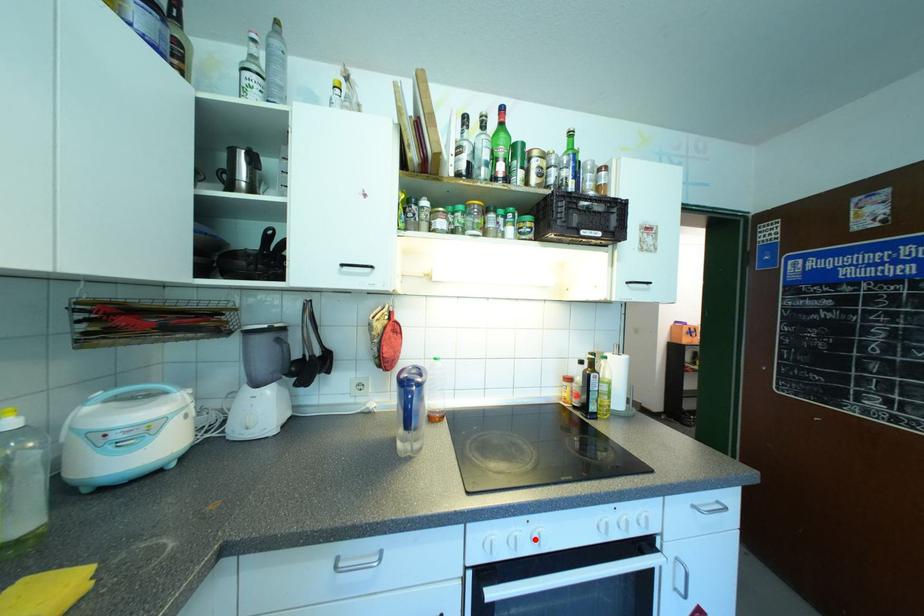
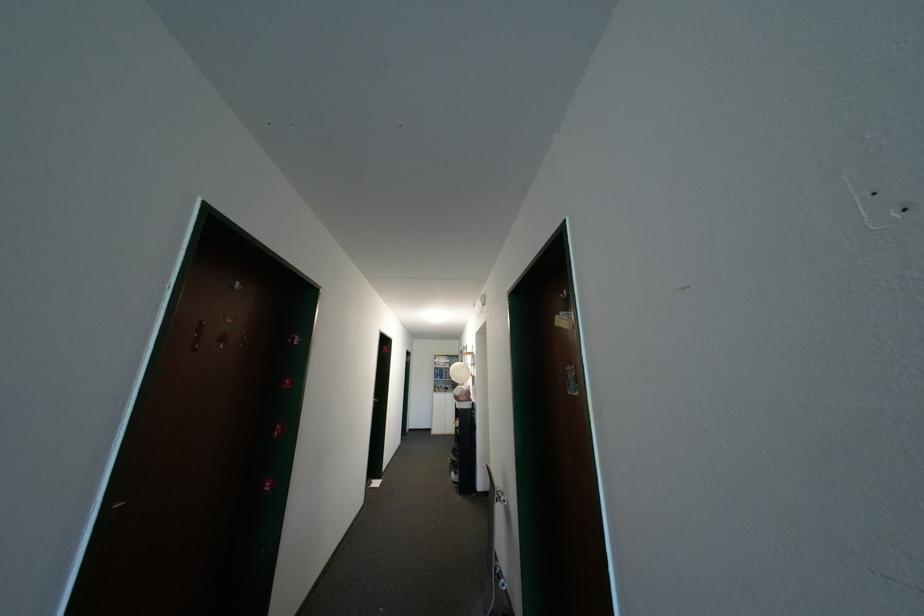
Question: I am providing you with two images of the same scene from different viewpoints. A red point is marked on the first image. Is the red point's position out of view in image 2?

Choices:
 (A) Yes
 (B) No

Answer: (A)